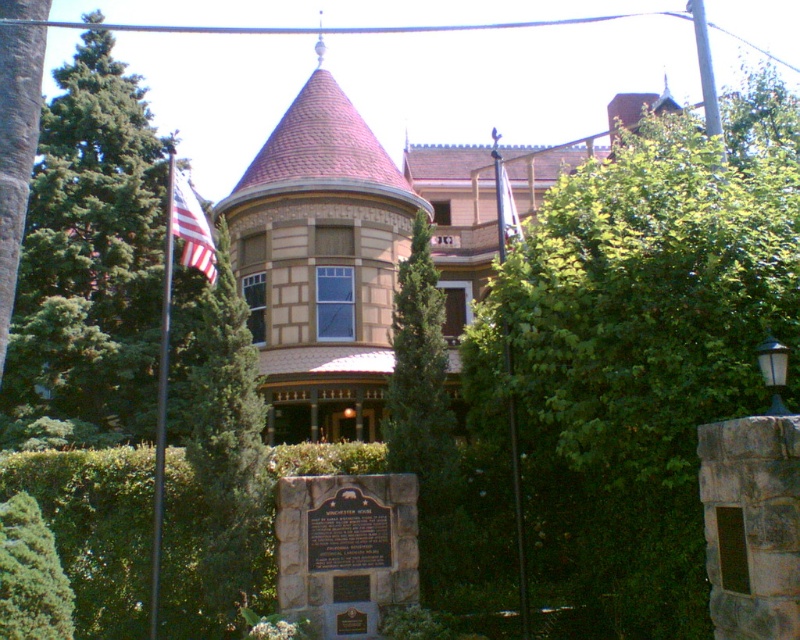
Between point (605, 131) and point (42, 637), which one is positioned in front?

Positioned in front is point (42, 637).

Who is positioned more to the left, brown textured mansion at center or green leafy hedge at lower left?

green leafy hedge at lower left is more to the left.

Who is more forward, (646, 100) or (57, 579)?

Point (57, 579) is in front.

What are the coordinates of `brown textured mansion at center` in the screenshot? It's located at (346, 257).

Is brown textured mansion at center positioned at the back of white fabric flag at upper center?

Yes, brown textured mansion at center is further from the viewer.

Is brown textured mansion at center in front of white fabric flag at upper center?

No, it is behind white fabric flag at upper center.

I want to click on brown textured mansion at center, so click(346, 257).

Is green textured tree at left bigger than green leafy hedge at lower left?

No, green textured tree at left is not bigger than green leafy hedge at lower left.

Who is taller, green textured tree at left or green leafy hedge at lower left?

green leafy hedge at lower left is taller.

What do you see at coordinates (226, 408) in the screenshot? I see `green textured tree at left` at bounding box center [226, 408].

Identify the location of green textured tree at left. The image size is (800, 640). (226, 408).